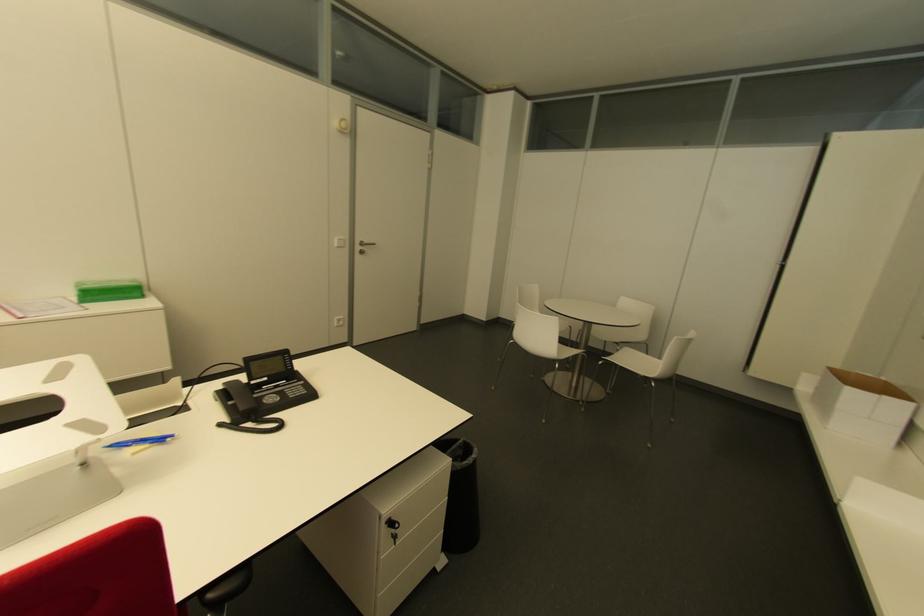
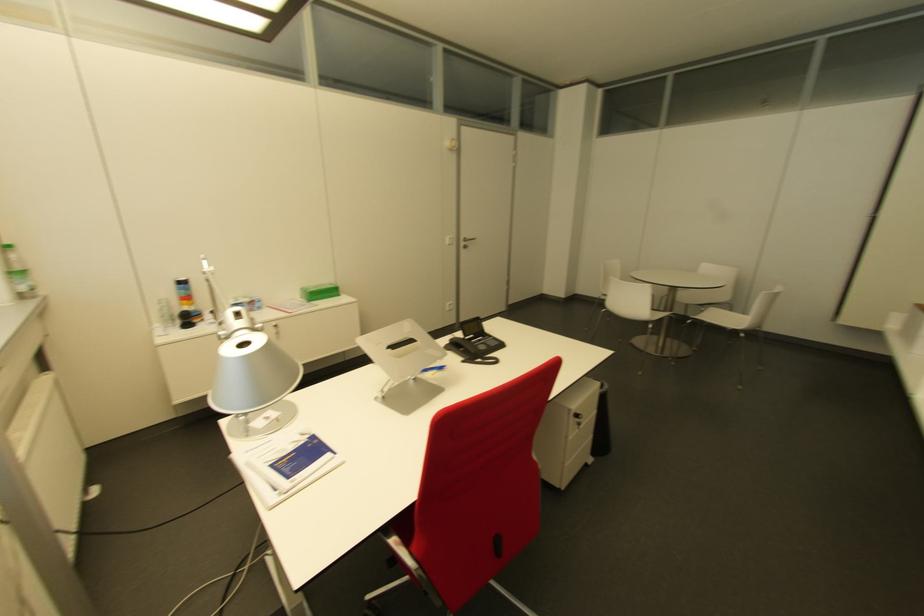
Find the pixel in the second image that matches point 159,440 in the first image.

(439, 369)